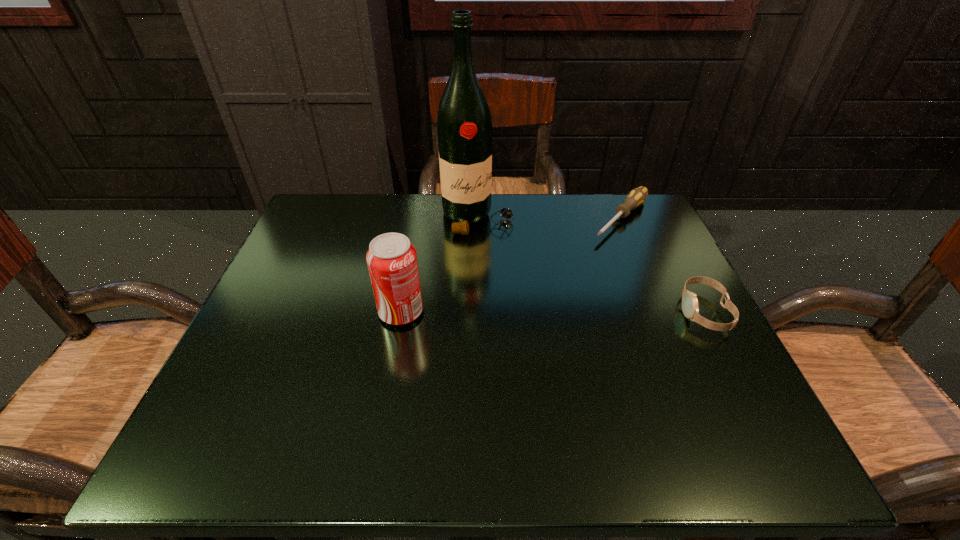
The width and height of the screenshot is (960, 540). What are the coordinates of `blank area located on the face of the second shortest object` in the screenshot? It's located at (532, 312).

In order to click on vacant position located on the face of the second shortest object in this screenshot , I will do `click(632, 312)`.

You are a GUI agent. You are given a task and a screenshot of the screen. Output one action in this format:
    pyautogui.click(x=<x>, y=<y>)
    Task: Click on the free space located 0.280m at the tip of the shortest object
    
    Given the screenshot: What is the action you would take?
    pyautogui.click(x=544, y=301)

Where is `free point located at the tip of the shortest object`? The image size is (960, 540). free point located at the tip of the shortest object is located at coordinates (516, 330).

The height and width of the screenshot is (540, 960). Identify the location of free region located 0.230m at the tip of the shortest object. (557, 288).

Locate an element on the screen. This screenshot has height=540, width=960. free region located 0.050m on the surface of the wine bottle is located at coordinates (503, 248).

At what (x,y) coordinates should I click in order to perform the action: click on vacant region located 0.200m on the surface of the wine bottle. Please return your answer as a coordinate pair (x, y). Image resolution: width=960 pixels, height=540 pixels. Looking at the image, I should click on (537, 287).

I want to click on vacant space located 0.350m on the surface of the wine bottle, so click(578, 336).

Identify the location of screwdriver at the far edge. (636, 197).

I want to click on wine bottle that is at the far edge, so click(464, 127).